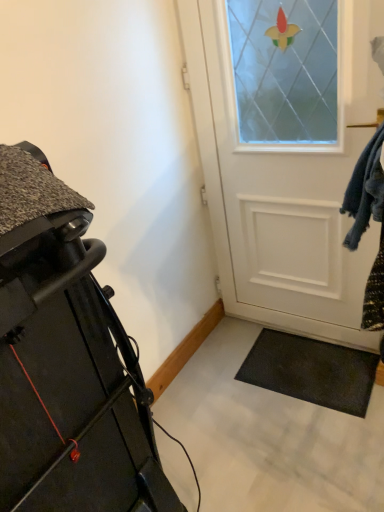
Question: Would you say matte black treadmill at left is outside white matte door at center?

Choices:
 (A) yes
 (B) no

Answer: (A)

Question: Can you confirm if matte black treadmill at left is smaller than white matte door at center?

Choices:
 (A) no
 (B) yes

Answer: (A)

Question: Considering the relative sizes of matte black treadmill at left and white matte door at center in the image provided, is matte black treadmill at left bigger than white matte door at center?

Choices:
 (A) yes
 (B) no

Answer: (A)

Question: Does matte black treadmill at left have a lesser width compared to white matte door at center?

Choices:
 (A) no
 (B) yes

Answer: (A)

Question: Is matte black treadmill at left taller than white matte door at center?

Choices:
 (A) yes
 (B) no

Answer: (B)

Question: Is matte black treadmill at left oriented towards white matte door at center?

Choices:
 (A) yes
 (B) no

Answer: (B)

Question: Does white matte door at center have a smaller size compared to matte black treadmill at left?

Choices:
 (A) no
 (B) yes

Answer: (B)

Question: Is white matte door at center turned away from matte black treadmill at left?

Choices:
 (A) no
 (B) yes

Answer: (A)

Question: Does white matte door at center have a larger size compared to matte black treadmill at left?

Choices:
 (A) yes
 (B) no

Answer: (B)

Question: From a real-world perspective, does white matte door at center stand above matte black treadmill at left?

Choices:
 (A) no
 (B) yes

Answer: (B)

Question: Can you confirm if white matte door at center is positioned to the right of matte black treadmill at left?

Choices:
 (A) no
 (B) yes

Answer: (B)

Question: Is white matte door at center positioned far away from matte black treadmill at left?

Choices:
 (A) no
 (B) yes

Answer: (B)

Question: From a real-world perspective, is matte black treadmill at left above or below white matte door at center?

Choices:
 (A) above
 (B) below

Answer: (B)